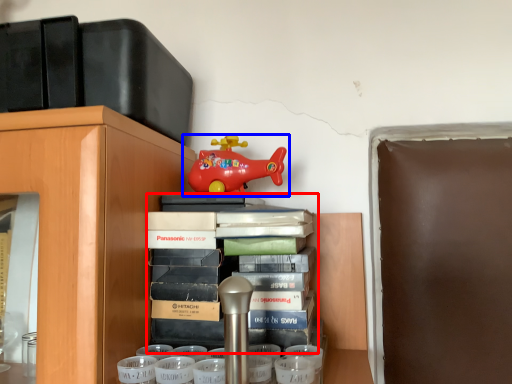
Question: Among these objects, which one is nearest to the camera, book (highlighted by a red box) or toy (highlighted by a blue box)?

Choices:
 (A) book
 (B) toy

Answer: (A)